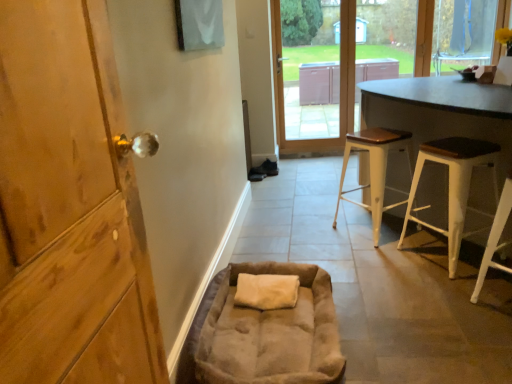
Question: Is white wood stool at lower right, the first stool in the front-to-back sequence, located within dark brown wood table at right?

Choices:
 (A) yes
 (B) no

Answer: (A)

Question: Does dark brown wood table at right have a greater height compared to white wood stool at lower right, the first stool in the front-to-back sequence?

Choices:
 (A) no
 (B) yes

Answer: (B)

Question: Can you confirm if dark brown wood table at right is bigger than white wood stool at lower right, which ranks as the 3th stool in back-to-front order?

Choices:
 (A) yes
 (B) no

Answer: (A)

Question: Is dark brown wood table at right closer to the viewer compared to white wood stool at lower right, the first stool in the front-to-back sequence?

Choices:
 (A) yes
 (B) no

Answer: (A)

Question: From the image's perspective, is dark brown wood table at right under white wood stool at lower right, the first stool in the front-to-back sequence?

Choices:
 (A) no
 (B) yes

Answer: (A)

Question: Is dark brown wood table at right outside of white wood stool at lower right, the first stool in the front-to-back sequence?

Choices:
 (A) yes
 (B) no

Answer: (A)

Question: Considering the relative positions of suede-like beige bean bag chair at lower center and white wood stool at right, which is counted as the 2th stool, starting from the back, in the image provided, is suede-like beige bean bag chair at lower center behind white wood stool at right, which is counted as the 2th stool, starting from the back,?

Choices:
 (A) no
 (B) yes

Answer: (A)

Question: From a real-world perspective, is suede-like beige bean bag chair at lower center positioned under white wood stool at right, placed as the 2th stool when sorted from front to back, based on gravity?

Choices:
 (A) no
 (B) yes

Answer: (B)

Question: From a real-world perspective, is suede-like beige bean bag chair at lower center on top of white wood stool at right, which is counted as the 2th stool, starting from the back?

Choices:
 (A) yes
 (B) no

Answer: (B)

Question: Is suede-like beige bean bag chair at lower center with white wood stool at right, placed as the 2th stool when sorted from front to back?

Choices:
 (A) yes
 (B) no

Answer: (B)

Question: Is suede-like beige bean bag chair at lower center outside white wood stool at right, which is counted as the 2th stool, starting from the back?

Choices:
 (A) yes
 (B) no

Answer: (A)

Question: Does suede-like beige bean bag chair at lower center appear on the right side of white wood stool at right, placed as the 2th stool when sorted from front to back?

Choices:
 (A) yes
 (B) no

Answer: (B)

Question: Does white wood stool at lower right, the first stool in the front-to-back sequence, have a greater height compared to dark brown wood table at right?

Choices:
 (A) no
 (B) yes

Answer: (A)